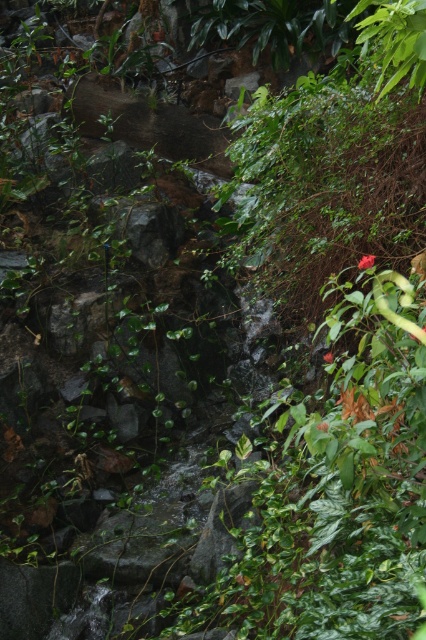
Question: Which object appears farthest from the camera in this image?

Choices:
 (A) green matte flower at center
 (B) red matte flower at center right

Answer: (B)

Question: Is green matte flower at center in front of red matte flower at center right?

Choices:
 (A) no
 (B) yes

Answer: (B)

Question: Does green matte flower at center come in front of red matte flower at center right?

Choices:
 (A) no
 (B) yes

Answer: (B)

Question: Can you confirm if green matte flower at center is bigger than red matte flower at center right?

Choices:
 (A) yes
 (B) no

Answer: (A)

Question: Which point is closer to the camera?

Choices:
 (A) red matte flower at center right
 (B) green matte flower at center

Answer: (B)

Question: Which object is farther from the camera taking this photo?

Choices:
 (A) red matte flower at center right
 (B) green matte flower at center

Answer: (A)